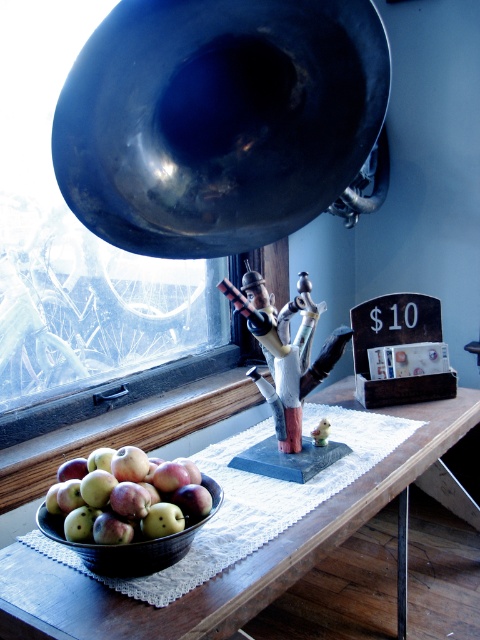
Is wooden table at lower left closer to camera compared to green matte apples at lower left?

Yes, it is in front of green matte apples at lower left.

The width and height of the screenshot is (480, 640). What do you see at coordinates (233, 564) in the screenshot?
I see `wooden table at lower left` at bounding box center [233, 564].

Find the location of `wooden table at lower left`. wooden table at lower left is located at coordinates (233, 564).

Can you confirm if shiny black trumpet at upper center is shorter than green matte apples at lower left?

No.

Does shiny black trumpet at upper center appear under green matte apples at lower left?

Incorrect, shiny black trumpet at upper center is not positioned below green matte apples at lower left.

The height and width of the screenshot is (640, 480). Find the location of `shiny black trumpet at upper center`. shiny black trumpet at upper center is located at coordinates (217, 120).

Identify the location of shiny black trumpet at upper center. pos(217,120).

Who is positioned more to the right, shiny black trumpet at upper center or wooden table at lower left?

wooden table at lower left

Does shiny black trumpet at upper center appear on the right side of wooden table at lower left?

No, shiny black trumpet at upper center is not to the right of wooden table at lower left.

Between point (240, 51) and point (257, 554), which one is positioned behind?

The point (257, 554) is more distant.

Identify the location of shiny black trumpet at upper center. (217, 120).